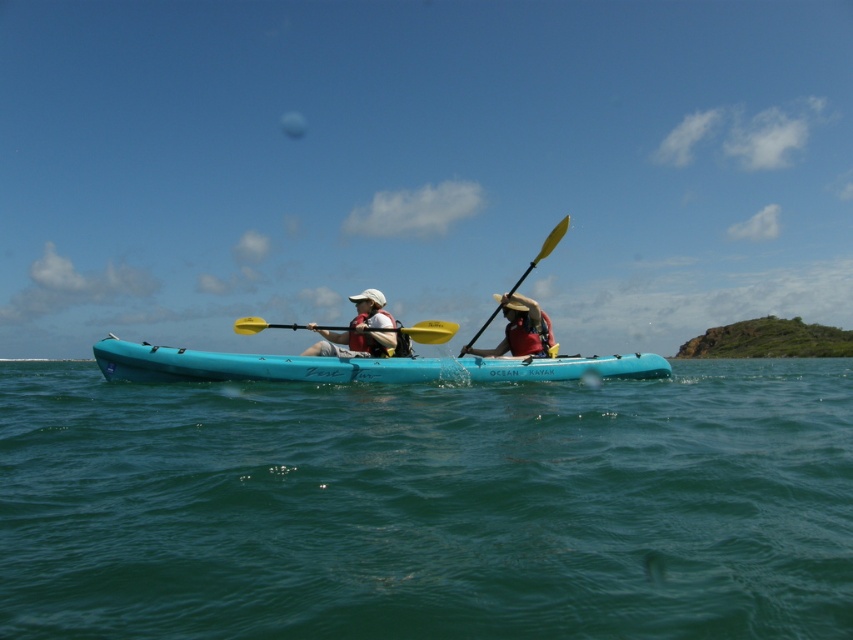
What do you see at coordinates (357, 365) in the screenshot? I see `teal rubber kayak at center` at bounding box center [357, 365].

Does teal rubber kayak at center have a greater width compared to yellow plastic paddle at center?

Yes, teal rubber kayak at center is wider than yellow plastic paddle at center.

Is point (265, 371) positioned after point (236, 323)?

No, (265, 371) is in front of (236, 323).

The width and height of the screenshot is (853, 640). I want to click on teal rubber kayak at center, so click(357, 365).

Who is taller, teal rubber kayak at center or red fabric hat at center?

Standing taller between the two is red fabric hat at center.

Who is more distant from viewer, (271, 369) or (534, 333)?

Point (534, 333)

Identify the location of teal rubber kayak at center. Image resolution: width=853 pixels, height=640 pixels. (357, 365).

The width and height of the screenshot is (853, 640). What do you see at coordinates (428, 506) in the screenshot?
I see `green water at center` at bounding box center [428, 506].

Can you confirm if green water at center is positioned above yellow matte paddle at center?

No, green water at center is not above yellow matte paddle at center.

Is point (782, 400) closer to camera compared to point (508, 298)?

Yes, it is.

Find the location of a particular element. The image size is (853, 640). green water at center is located at coordinates (428, 506).